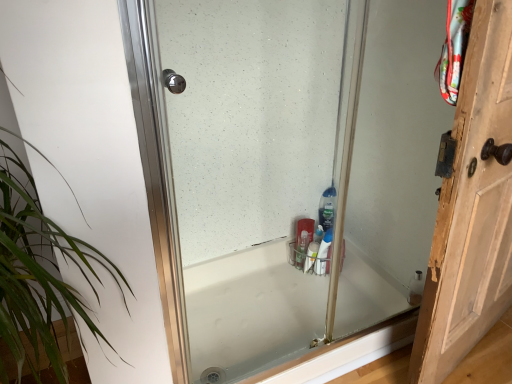
Question: Is clear glass shower door at center to the left of clear plastic bottle at center, the second cleaning product when ordered from front to back, from the viewer's perspective?

Choices:
 (A) no
 (B) yes

Answer: (B)

Question: From the image's perspective, would you say clear glass shower door at center is positioned over clear plastic bottle at center, arranged as the 2th cleaning product when ordered from the bottom?

Choices:
 (A) no
 (B) yes

Answer: (B)

Question: Is clear glass shower door at center thinner than clear plastic bottle at center, arranged as the 2th cleaning product when ordered from the bottom?

Choices:
 (A) yes
 (B) no

Answer: (B)

Question: Is clear glass shower door at center bigger than clear plastic bottle at center, arranged as the 2th cleaning product when ordered from the bottom?

Choices:
 (A) yes
 (B) no

Answer: (A)

Question: Can you confirm if clear glass shower door at center is smaller than clear plastic bottle at center, which appears as the 1th cleaning product when viewed from the top?

Choices:
 (A) no
 (B) yes

Answer: (A)

Question: From the image's perspective, is clear glass shower door at center beneath clear plastic bottle at center, which appears as the 1th cleaning product when viewed from the top?

Choices:
 (A) no
 (B) yes

Answer: (A)

Question: From a real-world perspective, does green leafy plant at left stand above clear plastic bottle at center, the second cleaning product when ordered from front to back?

Choices:
 (A) yes
 (B) no

Answer: (A)

Question: Considering the relative sizes of green leafy plant at left and clear plastic bottle at center, arranged as the 2th cleaning product when ordered from the bottom, in the image provided, is green leafy plant at left thinner than clear plastic bottle at center, arranged as the 2th cleaning product when ordered from the bottom,?

Choices:
 (A) no
 (B) yes

Answer: (A)

Question: Is clear plastic bottle at center, the second cleaning product when ordered from front to back, surrounded by green leafy plant at left?

Choices:
 (A) yes
 (B) no

Answer: (B)

Question: From a real-world perspective, is green leafy plant at left below clear plastic bottle at center, arranged as the 2th cleaning product when ordered from the bottom?

Choices:
 (A) no
 (B) yes

Answer: (A)

Question: Is green leafy plant at left oriented away from clear plastic bottle at center, which appears as the 1th cleaning product when viewed from the top?

Choices:
 (A) yes
 (B) no

Answer: (B)

Question: Does green leafy plant at left appear on the left side of clear plastic bottle at center, positioned as the 1th cleaning product in back-to-front order?

Choices:
 (A) yes
 (B) no

Answer: (A)

Question: Does white glossy bathtub at center turn towards green leafy plant at left?

Choices:
 (A) no
 (B) yes

Answer: (A)